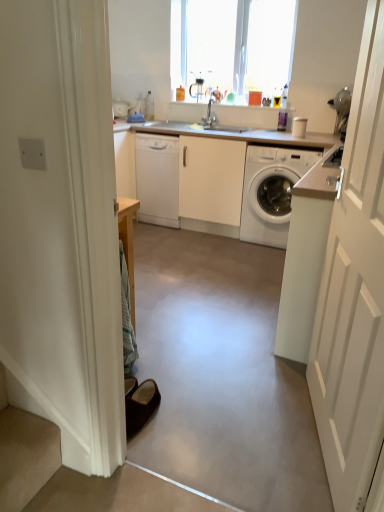
Question: Is white glossy washing machine at right positioned behind white wooden door at right?

Choices:
 (A) no
 (B) yes

Answer: (B)

Question: Does white glossy washing machine at right have a larger size compared to white wooden door at right?

Choices:
 (A) yes
 (B) no

Answer: (A)

Question: From a real-world perspective, is white glossy washing machine at right physically below white wooden door at right?

Choices:
 (A) no
 (B) yes

Answer: (B)

Question: Can you confirm if white glossy washing machine at right is positioned to the left of white wooden door at right?

Choices:
 (A) no
 (B) yes

Answer: (A)

Question: Is white glossy washing machine at right taller than white wooden door at right?

Choices:
 (A) yes
 (B) no

Answer: (B)

Question: From a real-world perspective, is brown suede slippers at lower left physically located above or below white glossy countertop at center?

Choices:
 (A) above
 (B) below

Answer: (B)

Question: In the image, is brown suede slippers at lower left on the left side or the right side of white glossy countertop at center?

Choices:
 (A) left
 (B) right

Answer: (A)

Question: Is brown suede slippers at lower left spatially inside white glossy countertop at center, or outside of it?

Choices:
 (A) inside
 (B) outside

Answer: (B)

Question: From the image's perspective, is brown suede slippers at lower left located above or below white glossy countertop at center?

Choices:
 (A) below
 (B) above

Answer: (A)

Question: From a real-world perspective, is brown suede slippers at lower left positioned above or below transparent glass window at upper center?

Choices:
 (A) above
 (B) below

Answer: (B)

Question: Is brown suede slippers at lower left wider or thinner than transparent glass window at upper center?

Choices:
 (A) wide
 (B) thin

Answer: (A)

Question: Considering the relative positions of brown suede slippers at lower left and transparent glass window at upper center in the image provided, is brown suede slippers at lower left to the left or to the right of transparent glass window at upper center?

Choices:
 (A) left
 (B) right

Answer: (A)

Question: From the image's perspective, is brown suede slippers at lower left located above or below transparent glass window at upper center?

Choices:
 (A) above
 (B) below

Answer: (B)

Question: From the image's perspective, relative to satin nickel faucet at center, is white glossy washing machine at right above or below?

Choices:
 (A) above
 (B) below

Answer: (B)

Question: Looking at the image, does white glossy washing machine at right seem bigger or smaller compared to satin nickel faucet at center?

Choices:
 (A) small
 (B) big

Answer: (B)